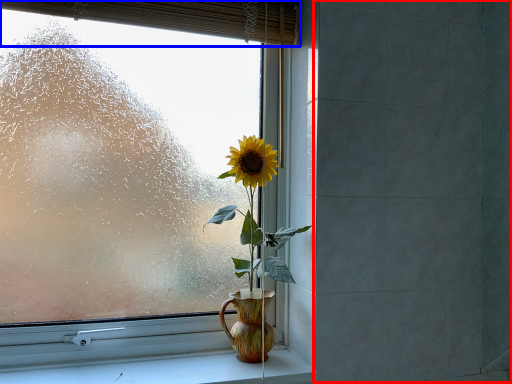
Question: Among these objects, which one is nearest to the camera, backdrop (highlighted by a red box) or curtain (highlighted by a blue box)?

Choices:
 (A) backdrop
 (B) curtain

Answer: (A)